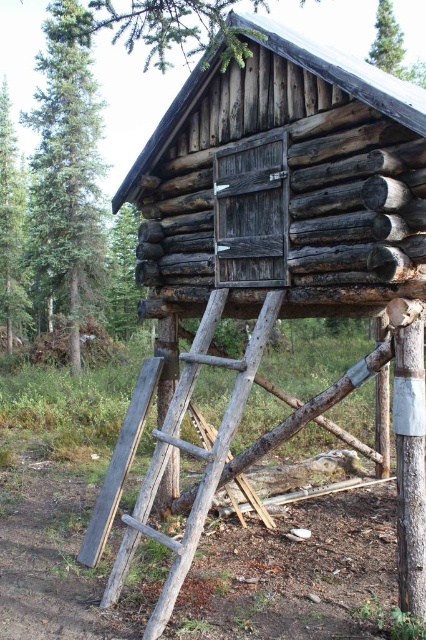
Can you confirm if green coniferous tree at left is smaller than green leafy tree at upper center?

No, green coniferous tree at left is not smaller than green leafy tree at upper center.

Find the location of a particular element. Image resolution: width=426 pixels, height=640 pixels. green coniferous tree at left is located at coordinates (68, 163).

Is point (48, 81) positioned behind point (236, 372)?

Yes, point (48, 81) is farther from viewer.

How much distance is there between green coniferous tree at left and rustic wood ladder at center?

A distance of 10.96 meters exists between green coniferous tree at left and rustic wood ladder at center.

Who is more forward, (43, 74) or (216, 445)?

Point (216, 445) is more forward.

Image resolution: width=426 pixels, height=640 pixels. Identify the location of green coniferous tree at left. (68, 163).

Does green rough bark tree at upper left come in front of green leafy tree at upper center?

Yes, green rough bark tree at upper left is closer to the viewer.

Does point (118, 230) lie in front of point (391, 45)?

That is False.

Locate an element on the screen. green rough bark tree at upper left is located at coordinates (123, 273).